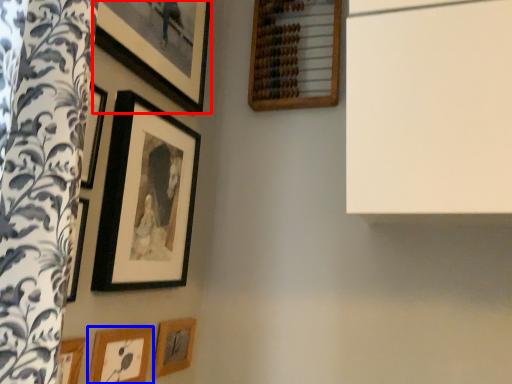
Question: Among these objects, which one is farthest to the camera, picture frame (highlighted by a red box) or picture frame (highlighted by a blue box)?

Choices:
 (A) picture frame
 (B) picture frame

Answer: (B)